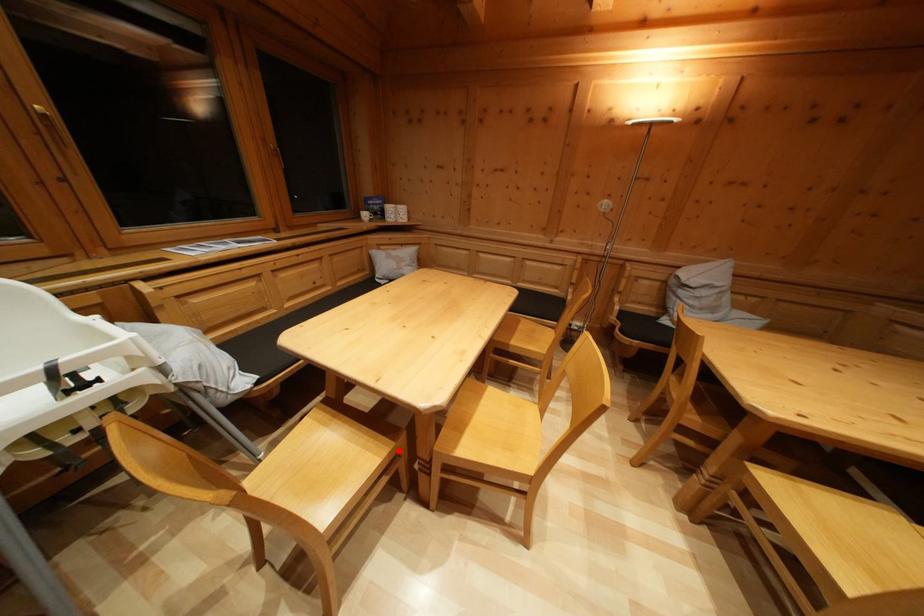
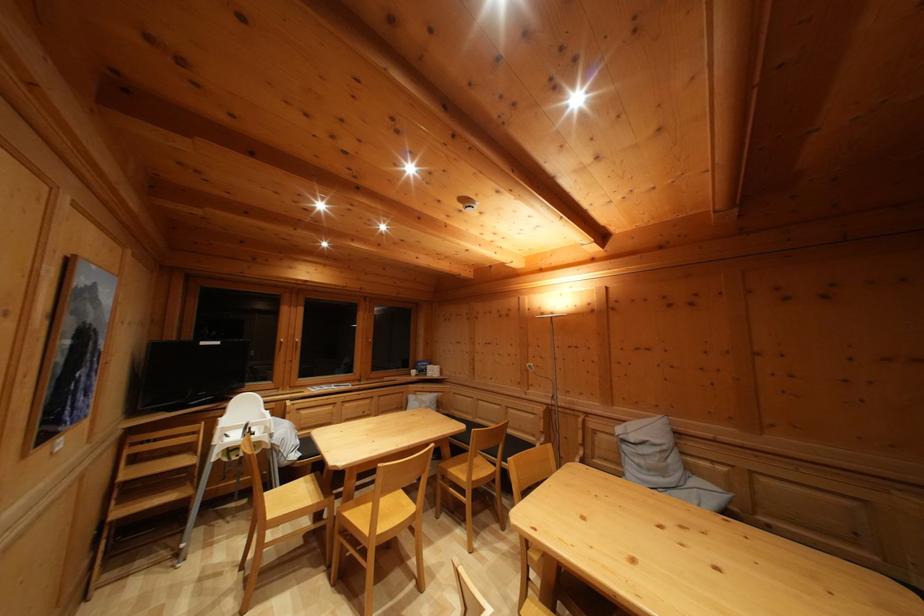
Question: I am providing you with two images of the same scene from different viewpoints. A red point is shown in image1. For the corresponding object point in image2, is it positioned nearer or farther from the camera?

Choices:
 (A) Nearer
 (B) Farther

Answer: (B)